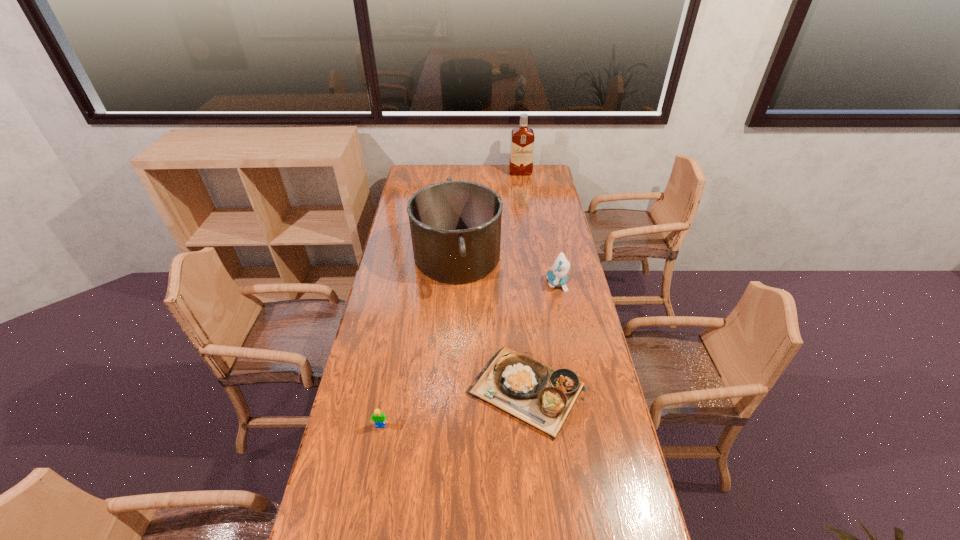
This screenshot has width=960, height=540. I want to click on free space that is in between the Lego and the shortest object, so click(x=454, y=409).

Find the location of a particular element. empty space that is in between the fourth shortest object and the kitten is located at coordinates (507, 270).

Select which object is the second closest to the Lego. Please provide its 2D coordinates. Your answer should be formatted as a tuple, i.e. [(x, y)], where the tuple contains the x and y coordinates of a point satisfying the conditions above.

[(455, 226)]

Identify which object is located as the second nearest to the pan. Please provide its 2D coordinates. Your answer should be formatted as a tuple, i.e. [(x, y)], where the tuple contains the x and y coordinates of a point satisfying the conditions above.

[(542, 397)]